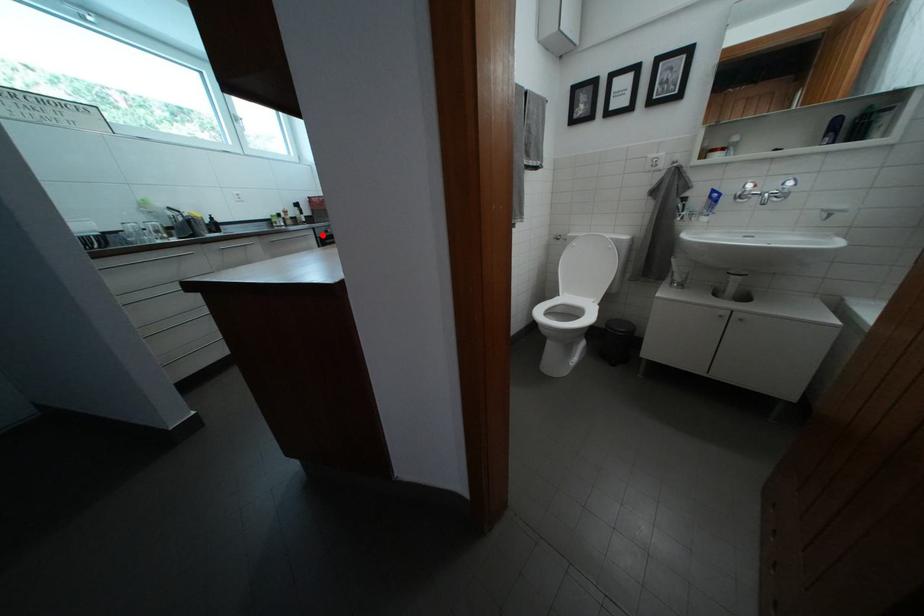
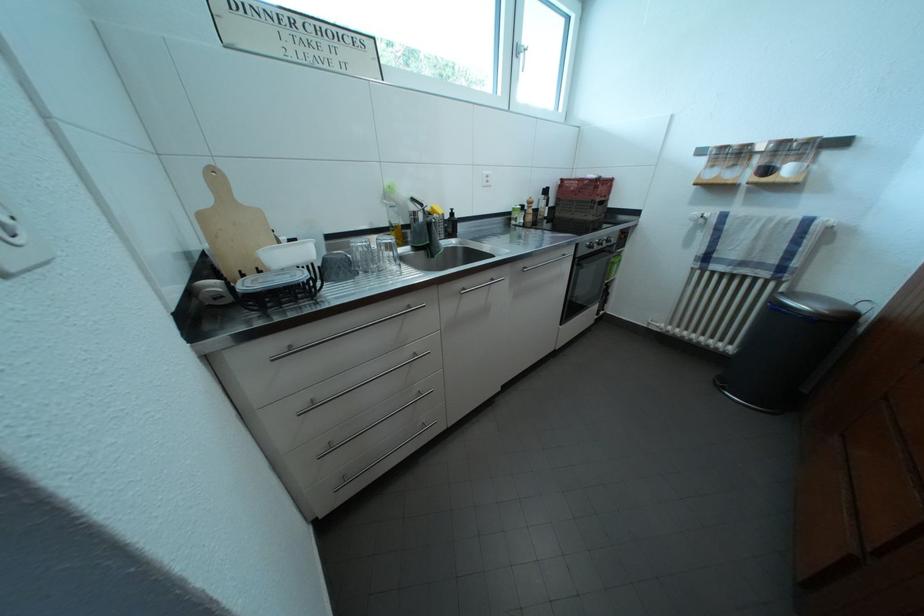
Question: I am providing you with two images of the same scene from different viewpoints. A red point is shown in image1. For the corresponding object point in image2, is it positioned nearer or farther from the camera?

Choices:
 (A) Nearer
 (B) Farther

Answer: (A)